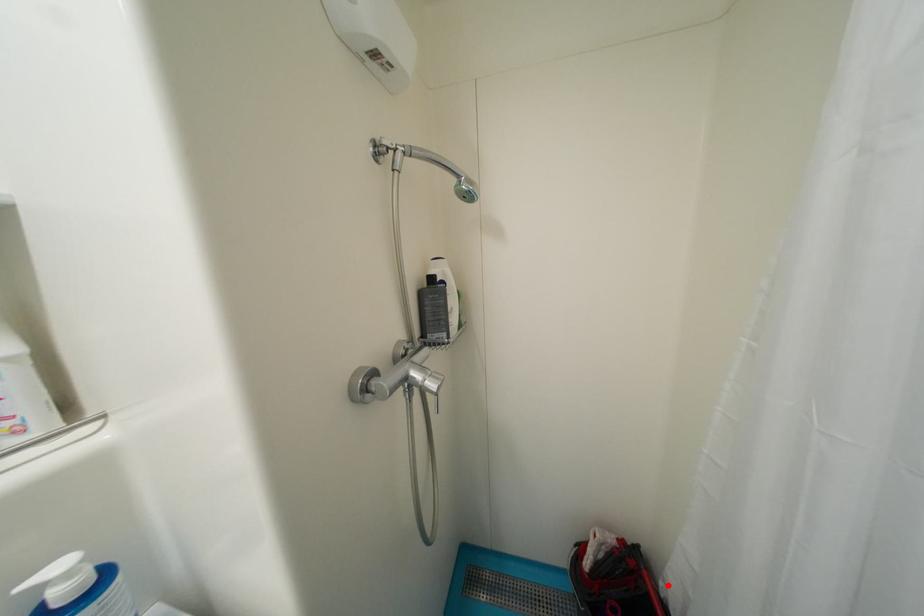
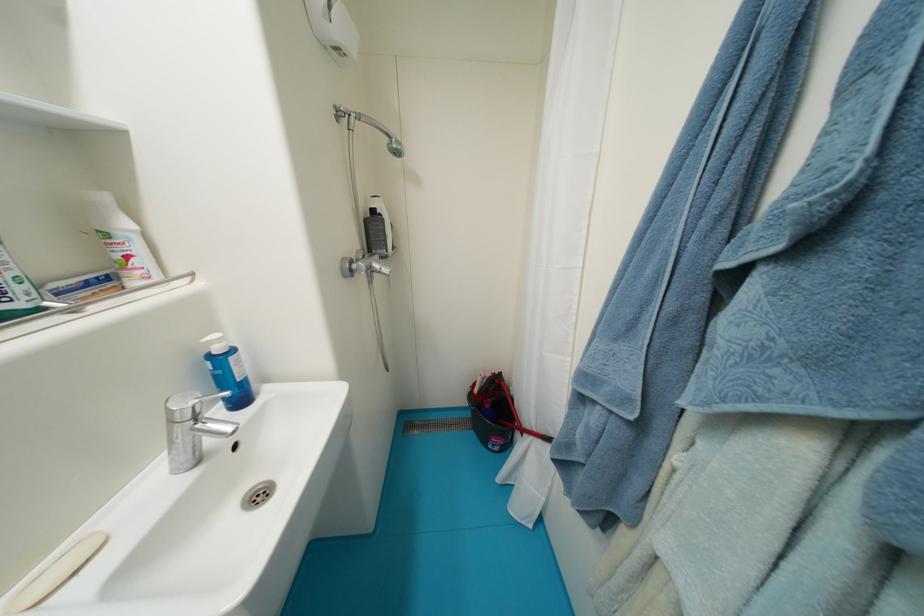
Question: I am providing you with two images of the same scene from different viewpoints. Given a red point in image1, look at the same physical point in image2. Is it:

Choices:
 (A) Closer to the viewpoint
 (B) Farther from the viewpoint

Answer: (B)